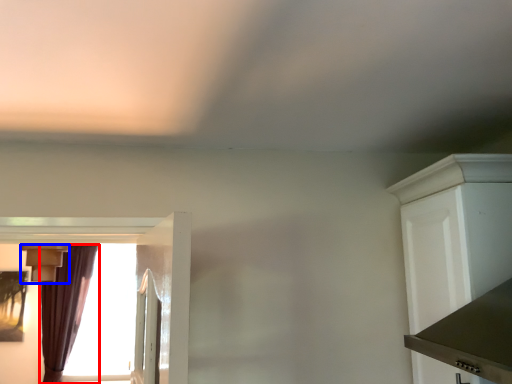
Question: Which of the following is the farthest to the observer, curtain (highlighted by a red box) or light fixture (highlighted by a blue box)?

Choices:
 (A) curtain
 (B) light fixture

Answer: (A)